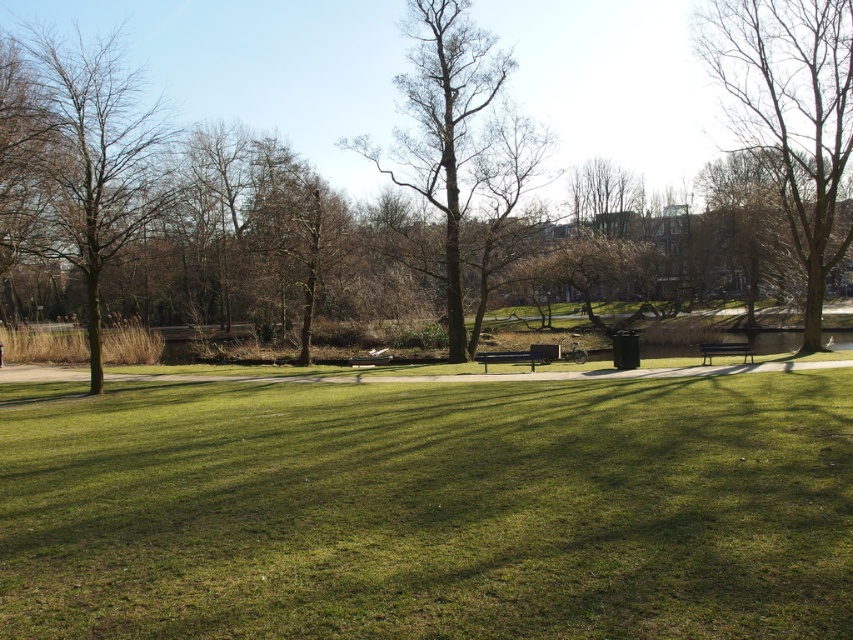
You are standing at the camera position and want to sit on the metallic silver bench at center. Is the bench within a comfortable walking distance?

The metallic silver bench at center is 28.13 meters away from camera, which is a comfortable walking distance for most people, so yes, you can walk to it easily.

You are planning to hang a bird feeder between the brown leafless tree at upper right and the brown textured tree at left. Considering their thickness, which tree would be more suitable for supporting the feeder?

The brown textured tree at left is thicker than the brown leafless tree at upper right, making it more suitable for supporting the bird feeder.

Based on the photo, you are standing in the park and want to know how far the point at coordinates (187, 400) is from you. Can you determine the distance?

The distance of point (187, 400) from viewer is 65.83 feet.